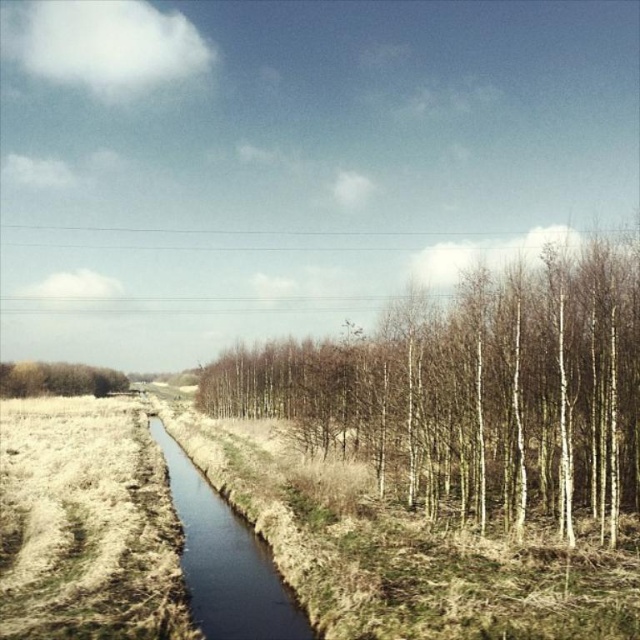
Is brown grassy stream at center below brown textured tree at left?

Yes, brown grassy stream at center is below brown textured tree at left.

Who is lower down, brown grassy stream at center or brown textured tree at left?

brown grassy stream at center is lower down.

Is point (236, 609) more distant than point (24, 369)?

No.

This screenshot has height=640, width=640. Find the location of `brown grassy stream at center`. brown grassy stream at center is located at coordinates (225, 560).

Looking at this image, is bare wood trees at center wider than brown textured tree at left?

Yes.

Is point (593, 250) in front of point (26, 362)?

Yes.

What are the coordinates of `bare wood trees at center` in the screenshot? It's located at (476, 392).

Can you confirm if bare wood trees at center is shorter than brown grassy stream at center?

No, bare wood trees at center is not shorter than brown grassy stream at center.

Is bare wood trees at center further to the viewer compared to brown grassy stream at center?

Yes, bare wood trees at center is further from the viewer.

Find the location of a particular element. The image size is (640, 640). bare wood trees at center is located at coordinates (476, 392).